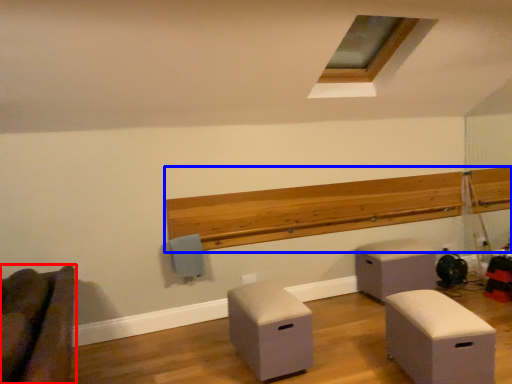
Question: Which object is closer to the camera taking this photo, furniture (highlighted by a red box) or ledge (highlighted by a blue box)?

Choices:
 (A) furniture
 (B) ledge

Answer: (A)